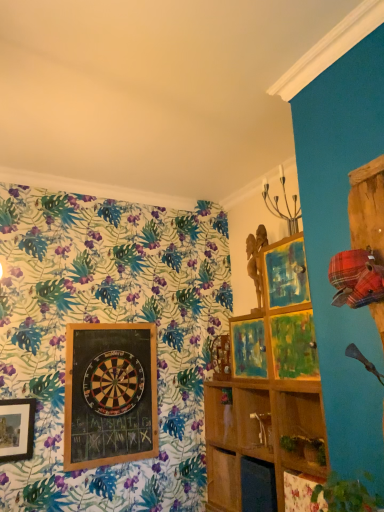
Question: Is wooden shelf at center, arranged as the first shelf when viewed from the front, taller or shorter than wooden dartboard at center-left?

Choices:
 (A) short
 (B) tall

Answer: (B)

Question: From a real-world perspective, relative to wooden dartboard at center-left, is wooden shelf at center, which ranks as the second shelf in back-to-front order, vertically above or below?

Choices:
 (A) above
 (B) below

Answer: (B)

Question: Which of these objects is positioned closest to the wooden dartboard at center?

Choices:
 (A) wooden dartboard at center-left
 (B) wooden shelf at center, arranged as the second shelf when viewed from the front
 (C) wooden shelf at center, arranged as the first shelf when viewed from the front

Answer: (A)

Question: Based on their relative distances, which object is farther from the wooden dartboard at center?

Choices:
 (A) wooden shelf at center, which ranks as the second shelf in back-to-front order
 (B) wooden shelf at center, arranged as the second shelf when viewed from the front
 (C) wooden dartboard at center-left

Answer: (A)